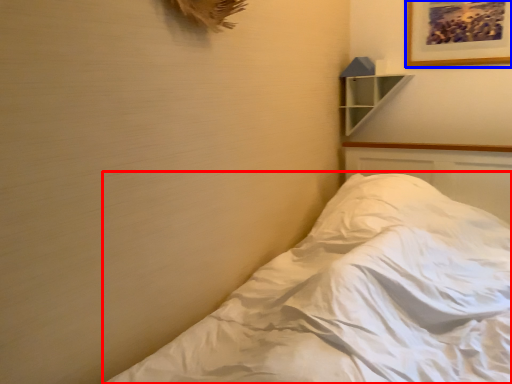
Question: Among these objects, which one is nearest to the camera, bed (highlighted by a red box) or picture frame (highlighted by a blue box)?

Choices:
 (A) bed
 (B) picture frame

Answer: (A)